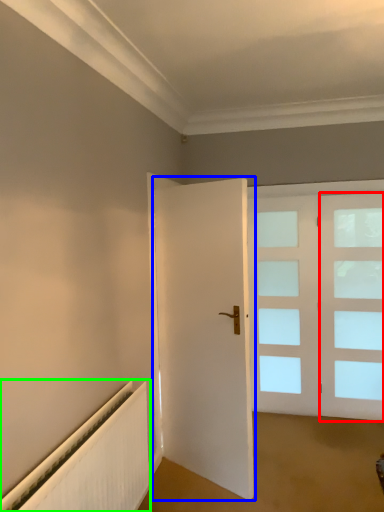
Question: Estimate the real-world distances between objects in this image. Which object is farther from window (highlighted by a red box), door (highlighted by a blue box) or radiator (highlighted by a green box)?

Choices:
 (A) door
 (B) radiator

Answer: (B)